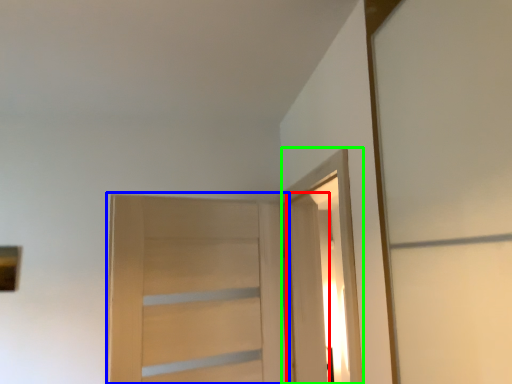
Question: Which object is positioned closest to door (highlighted by a red box)? Select from door (highlighted by a blue box) and elevator (highlighted by a green box).

Choices:
 (A) door
 (B) elevator

Answer: (B)